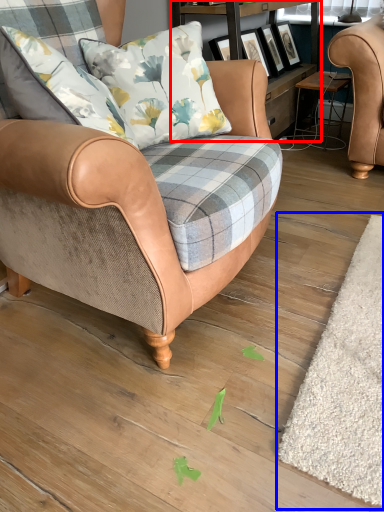
Question: Which object is further to the camera taking this photo, shelf (highlighted by a red box) or mat (highlighted by a blue box)?

Choices:
 (A) shelf
 (B) mat

Answer: (A)